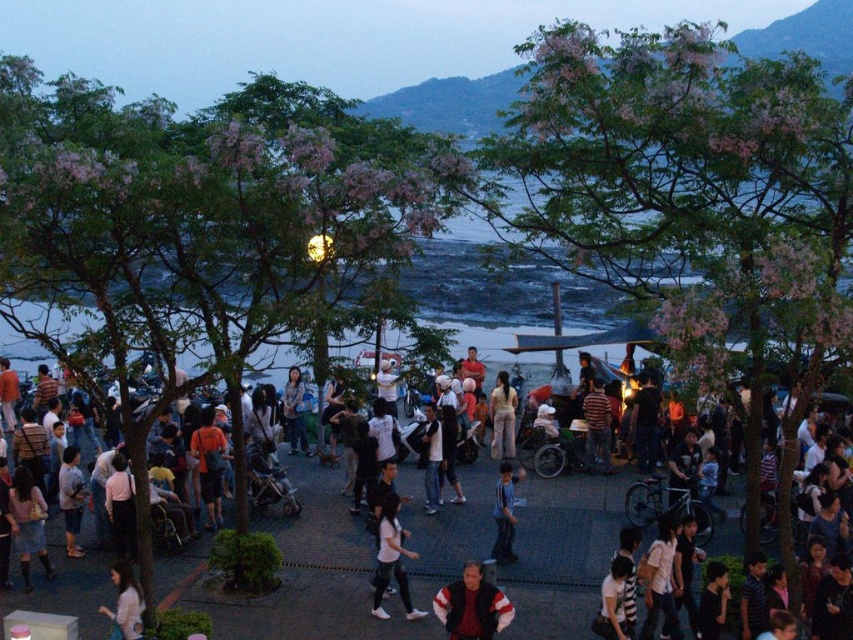
You are standing in the crowd at the waterfront and want to take a photo of the two points mentioned. Which point, point (805, 362) or point (476, 609), will appear larger in your camera view?

Point (805, 362) will appear larger in your camera view because it is closer to the camera than point (476, 609).

You are a photographer planning to take a group photo of the crowd in the waterfront area. You notice the green leafy tree at center and the light pink fabric at lower left in your frame. Which object occupies more horizontal space in the image?

The green leafy tree at center occupies more horizontal space than the light pink fabric at lower left because its width surpasses the fabric.